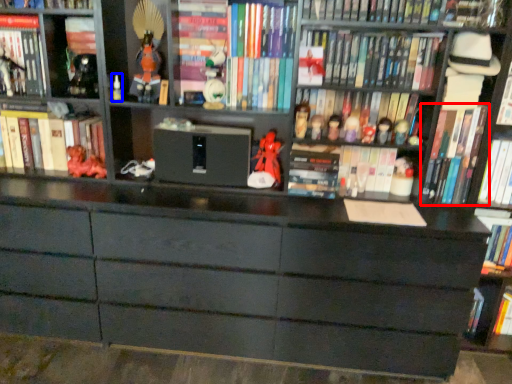
Question: Which object appears closest to the camera in this image, book (highlighted by a red box) or toy (highlighted by a blue box)?

Choices:
 (A) book
 (B) toy

Answer: (A)